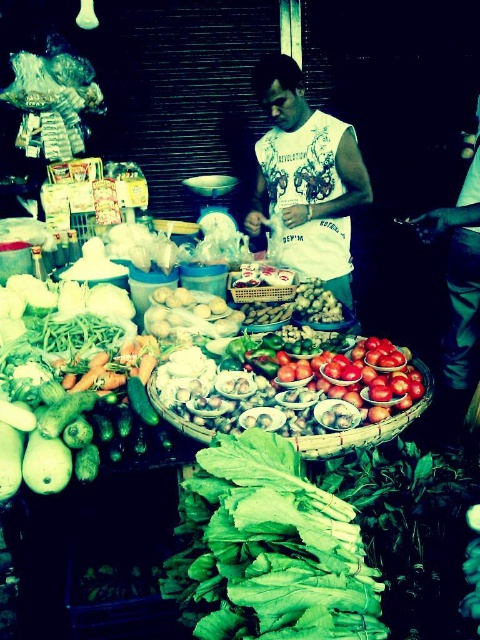
Does white printed t-shirt at center have a greater height compared to wooden woven basket at center?

Correct, white printed t-shirt at center is much taller as wooden woven basket at center.

Find the location of a particular element. The image size is (480, 640). white printed t-shirt at center is located at coordinates (307, 177).

Which is behind, point (228, 529) or point (302, 202)?

The point (302, 202) is behind.

Who is more forward, (349, 522) or (336, 195)?

Point (349, 522) is in front.

You are a GUI agent. You are given a task and a screenshot of the screen. Output one action in this format:
    pyautogui.click(x=<x>, y=<y>)
    Task: Click on the green leafy at center
    The width and height of the screenshot is (480, 640).
    Given the screenshot: What is the action you would take?
    pyautogui.click(x=269, y=548)

Is green leafy at center positioned in front of wooden woven basket at center?

Yes, green leafy at center is in front of wooden woven basket at center.

Does green leafy at center have a greater width compared to wooden woven basket at center?

Yes, green leafy at center is wider than wooden woven basket at center.

Find the location of a particular element. This screenshot has height=640, width=480. green leafy at center is located at coordinates (269, 548).